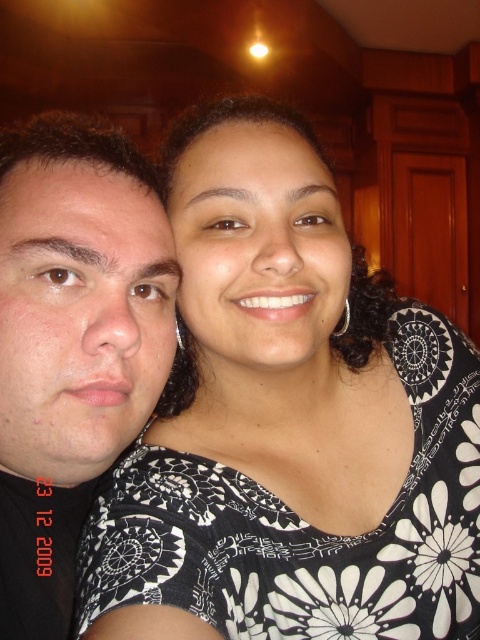
Between black floral dress at center and matte black face at left, which one appears on the left side from the viewer's perspective?

matte black face at left

What are the coordinates of `black floral dress at center` in the screenshot? It's located at (288, 422).

The image size is (480, 640). Identify the location of black floral dress at center. (288, 422).